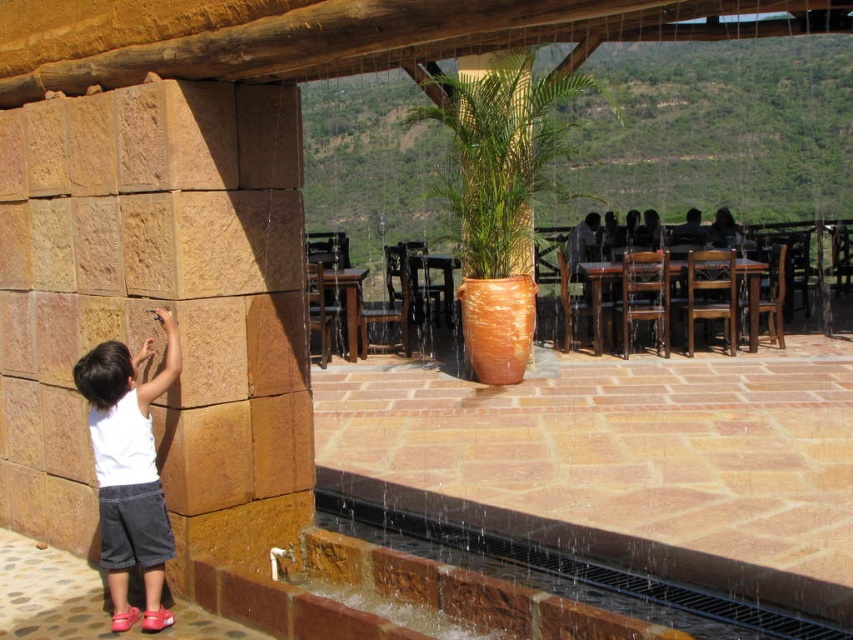
Does point (181, 508) come behind point (102, 461)?

Yes, it is behind point (102, 461).

Does brown stone wall at left have a lesser height compared to white cotton shirt at left?

No.

Image resolution: width=853 pixels, height=640 pixels. What do you see at coordinates (160, 304) in the screenshot? I see `brown stone wall at left` at bounding box center [160, 304].

Locate an element on the screen. This screenshot has width=853, height=640. brown stone wall at left is located at coordinates (160, 304).

Is white cotton shirt at left positioned at the back of terracotta clay pot at center?

That is False.

Which is in front, point (144, 592) or point (503, 371)?

Positioned in front is point (144, 592).

What do you see at coordinates (129, 468) in the screenshot? The width and height of the screenshot is (853, 640). I see `white cotton shirt at left` at bounding box center [129, 468].

The image size is (853, 640). Find the location of `white cotton shirt at left`. white cotton shirt at left is located at coordinates (129, 468).

Which is more to the right, brown stone wall at left or terracotta clay pot at center?

terracotta clay pot at center is more to the right.

Is point (135, 221) positioned before point (480, 60)?

That is True.

I want to click on brown stone wall at left, so click(x=160, y=304).